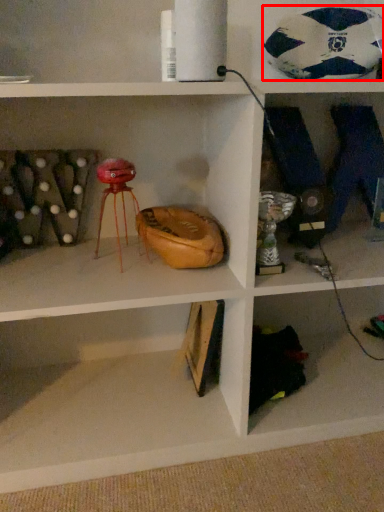
Question: From the image, what is the correct spatial relationship of football (annotated by the red box) in relation to shelf?

Choices:
 (A) left
 (B) right

Answer: (B)